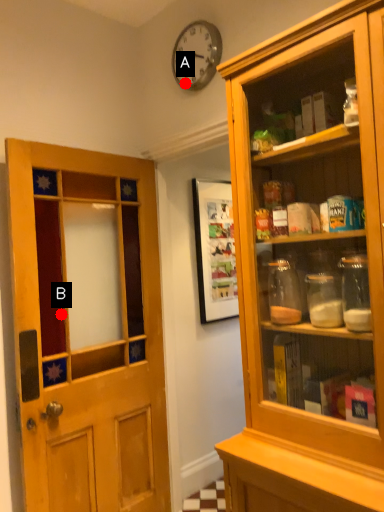
Question: Two points are circled on the image, labeled by A and B beside each circle. Which point is closer to the camera taking this photo?

Choices:
 (A) A is closer
 (B) B is closer

Answer: (B)